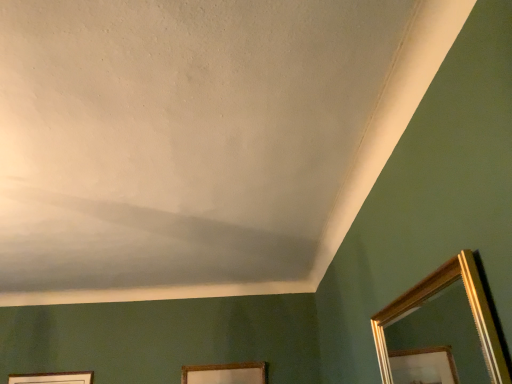
Question: Is gold-framed mirror at lower right turned away from gold wooden picture frame at lower center?

Choices:
 (A) yes
 (B) no

Answer: (B)

Question: Is gold wooden picture frame at lower center completely or partially inside gold-framed mirror at lower right?

Choices:
 (A) no
 (B) yes

Answer: (A)

Question: Is gold-framed mirror at lower right behind gold wooden picture frame at lower center?

Choices:
 (A) no
 (B) yes

Answer: (A)

Question: Is gold-framed mirror at lower right shorter than gold wooden picture frame at lower center?

Choices:
 (A) yes
 (B) no

Answer: (B)

Question: Considering the relative positions of gold-framed mirror at lower right and gold wooden picture frame at lower center in the image provided, is gold-framed mirror at lower right to the left of gold wooden picture frame at lower center from the viewer's perspective?

Choices:
 (A) no
 (B) yes

Answer: (A)

Question: Does gold-framed mirror at lower right come in front of gold wooden picture frame at lower center?

Choices:
 (A) yes
 (B) no

Answer: (A)

Question: Could you tell me if gold wooden picture frame at lower center is facing gold-framed mirror at lower right?

Choices:
 (A) no
 (B) yes

Answer: (B)

Question: From the image's perspective, is gold wooden picture frame at lower center above gold-framed mirror at lower right?

Choices:
 (A) yes
 (B) no

Answer: (B)

Question: Is gold wooden picture frame at lower center positioned with its back to gold-framed mirror at lower right?

Choices:
 (A) yes
 (B) no

Answer: (B)

Question: Can you confirm if gold wooden picture frame at lower center is thinner than gold-framed mirror at lower right?

Choices:
 (A) yes
 (B) no

Answer: (A)

Question: Is gold wooden picture frame at lower center touching gold-framed mirror at lower right?

Choices:
 (A) no
 (B) yes

Answer: (A)

Question: Does gold wooden picture frame at lower center appear on the right side of gold-framed mirror at lower right?

Choices:
 (A) yes
 (B) no

Answer: (B)

Question: Considering their positions, is gold wooden picture frame at lower center located in front of or behind gold-framed mirror at lower right?

Choices:
 (A) front
 (B) behind

Answer: (B)